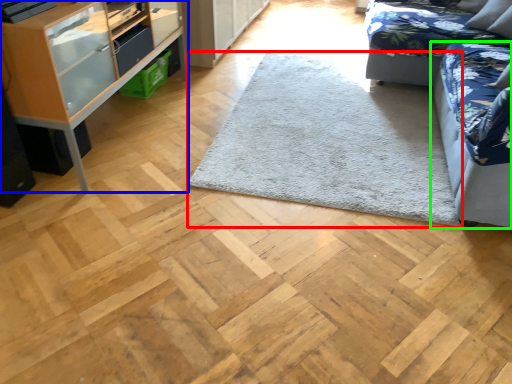
Question: Which object is positioned closest to mat (highlighted by a red box)? Select from shelf (highlighted by a blue box) and studio couch (highlighted by a green box).

Choices:
 (A) shelf
 (B) studio couch

Answer: (B)